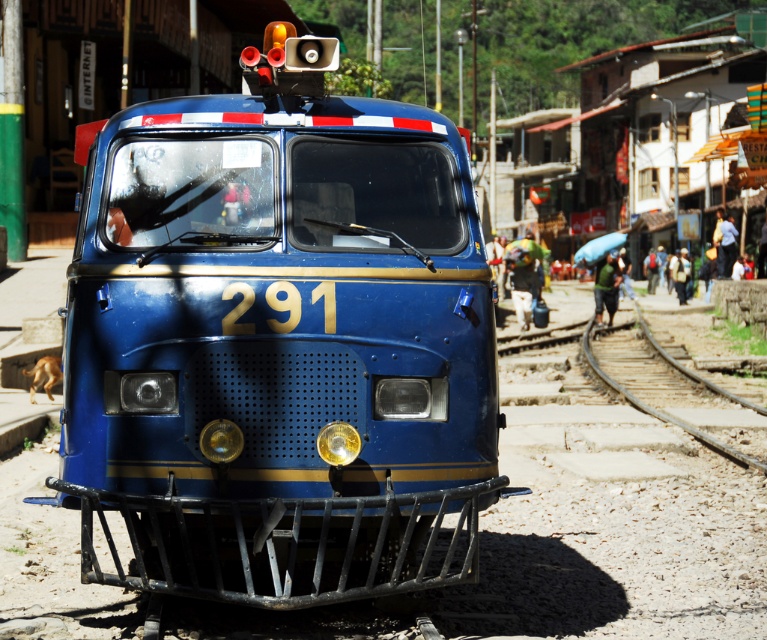
From the picture: Between matte blue train at center and brown wooden train track at lower right, which one appears on the left side from the viewer's perspective?

Positioned to the left is matte blue train at center.

Between point (104, 182) and point (695, 436), which one is positioned in front?

Point (104, 182)

Is point (303, 545) positioned behind point (591, 365)?

No, it is not.

Locate an element on the screen. Image resolution: width=767 pixels, height=640 pixels. matte blue train at center is located at coordinates (278, 342).